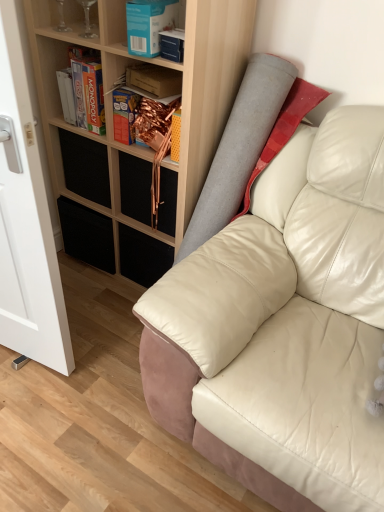
Question: Considering the relative sizes of white glossy glass door at left and blue cardboard box at upper center, the 2th book from the back, in the image provided, is white glossy glass door at left taller than blue cardboard box at upper center, the 2th book from the back,?

Choices:
 (A) yes
 (B) no

Answer: (A)

Question: Is white glossy glass door at left far from blue cardboard box at upper center, which is the 1th book from front to back?

Choices:
 (A) yes
 (B) no

Answer: (B)

Question: Is white glossy glass door at left facing towards blue cardboard box at upper center, which is the 1th book from front to back?

Choices:
 (A) no
 (B) yes

Answer: (A)

Question: Does white glossy glass door at left touch blue cardboard box at upper center, the 2th book from the back?

Choices:
 (A) no
 (B) yes

Answer: (A)

Question: Is white glossy glass door at left positioned beyond the bounds of blue cardboard box at upper center, the 2th book from the back?

Choices:
 (A) yes
 (B) no

Answer: (A)

Question: From a real-world perspective, relative to metallic gold drawer at center, positioned as the first drawer in right-to-left order, is white glossy glass door at left vertically above or below?

Choices:
 (A) above
 (B) below

Answer: (A)

Question: Visually, is white glossy glass door at left positioned to the left or to the right of metallic gold drawer at center, positioned as the first drawer in right-to-left order?

Choices:
 (A) right
 (B) left

Answer: (B)

Question: In terms of size, does white glossy glass door at left appear bigger or smaller than metallic gold drawer at center, which is the 2th drawer from left to right?

Choices:
 (A) small
 (B) big

Answer: (B)

Question: From their relative heights in the image, would you say white glossy glass door at left is taller or shorter than metallic gold drawer at center, positioned as the first drawer in right-to-left order?

Choices:
 (A) tall
 (B) short

Answer: (A)

Question: In terms of width, does white leather couch at center look wider or thinner when compared to white glossy glass door at left?

Choices:
 (A) thin
 (B) wide

Answer: (B)

Question: Is point (165, 373) closer or farther from the camera than point (11, 152)?

Choices:
 (A) farther
 (B) closer

Answer: (A)

Question: From a real-world perspective, relative to white glossy glass door at left, is white leather couch at center vertically above or below?

Choices:
 (A) below
 (B) above

Answer: (A)

Question: Is white leather couch at center bigger or smaller than white glossy glass door at left?

Choices:
 (A) big
 (B) small

Answer: (A)

Question: Relative to wooden bookshelf at upper left, which is counted as the 2th shelf, starting from the left, is blue cardboard box at upper center, which is the 1th book from front to back, in front or behind?

Choices:
 (A) behind
 (B) front

Answer: (A)

Question: From a real-world perspective, relative to wooden bookshelf at upper left, which is counted as the 1th shelf, starting from the bottom, is blue cardboard box at upper center, which is the 1th book from front to back, vertically above or below?

Choices:
 (A) above
 (B) below

Answer: (A)